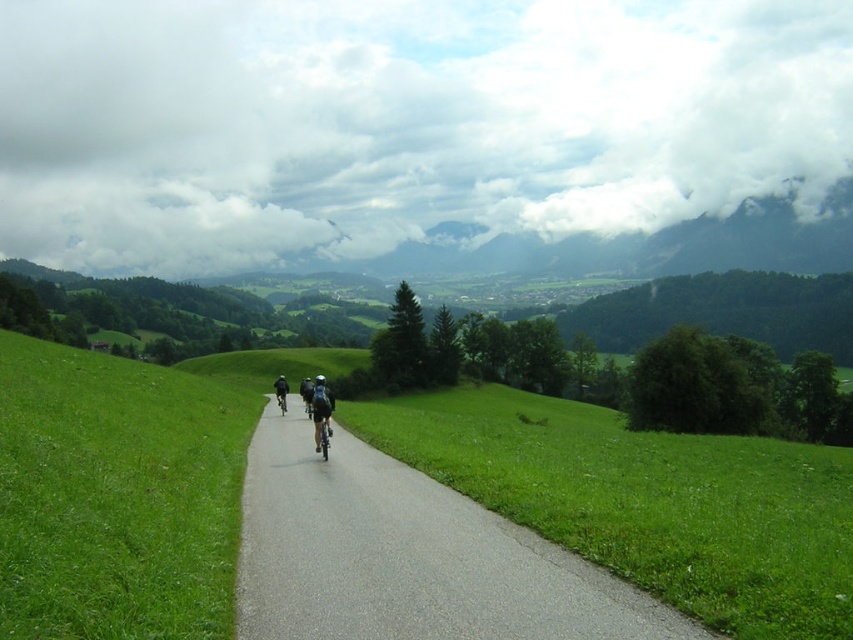
Question: Which of these objects is positioned closest to the green grassy at center?

Choices:
 (A) shiny black bicycle at center
 (B) shiny metallic bicycle at center
 (C) gray asphalt road at center

Answer: (C)

Question: Which point is farther to the camera?

Choices:
 (A) green grassy at center
 (B) shiny metallic bicycle at center
 (C) shiny black bicycle at center
 (D) dark blue helmet at center

Answer: (C)

Question: Is gray asphalt road at center smaller than black matte bicycle at center?

Choices:
 (A) yes
 (B) no

Answer: (A)

Question: Can you confirm if shiny metallic bicycle at center is wider than black matte bicycle at center?

Choices:
 (A) yes
 (B) no

Answer: (B)

Question: Which point is closer to the camera?

Choices:
 (A) (282, 406)
 (B) (477, 577)
 (C) (318, 422)

Answer: (B)

Question: Can you confirm if dark blue fabric cyclist at center is positioned below black matte bicycle at center?

Choices:
 (A) no
 (B) yes

Answer: (B)